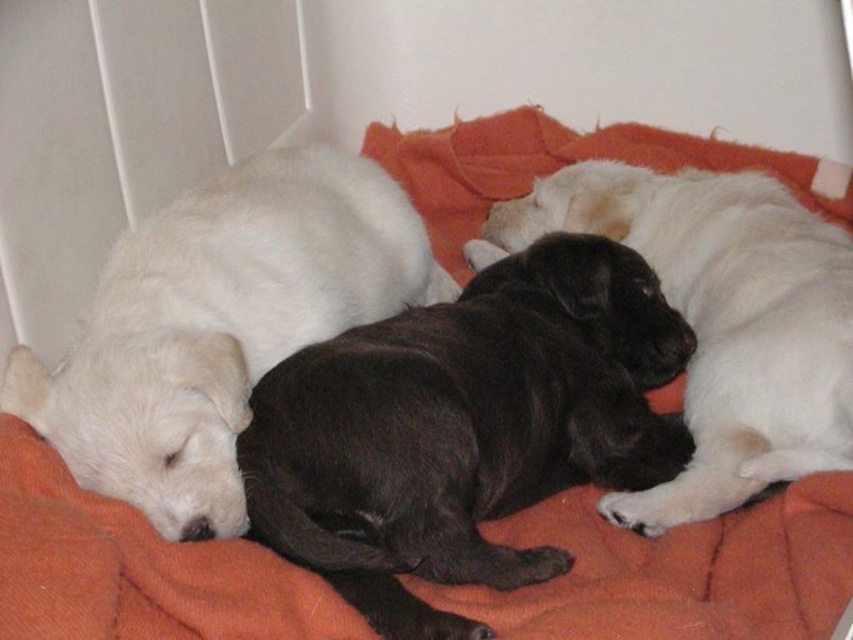
You are a veterinarian examining the three puppies on the orange blanket. You need to determine which puppy is smaller between the black soft fur puppy at center and the white soft fur at left. Which one is smaller?

The black soft fur puppy at center is smaller compared to the white soft fur at left.

You are a photographer wanting to capture the black soft fur puppy at center and the black smooth fur at center in a clear shot. Since you want both puppies to be in focus, which one should you adjust your camera focus to prioritize based on their positions?

The black soft fur puppy at center is in front of the black smooth fur at center, so you should focus on the black soft fur puppy at center to ensure both are in focus as it is closer to the camera.

You are a photographer trying to capture a closeup of the middle puppy. You notice two points in the image labeled as point (517, 561) and point (190, 467). Which point should you focus on to ensure the middle puppy is in focus?

You should focus on point (517, 561) because it is closer to the camera than point (190, 467), ensuring the middle puppy is in focus.